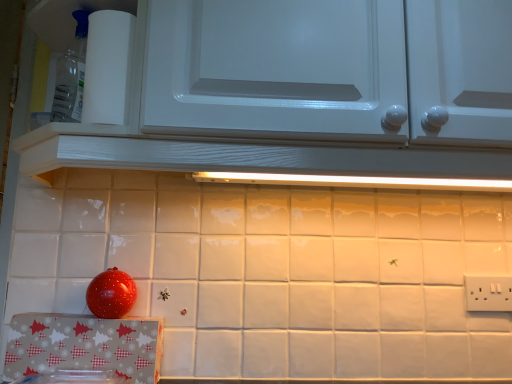
Question: Does white paper towel at upper left come behind white glossy cabinet at upper center?

Choices:
 (A) yes
 (B) no

Answer: (A)

Question: From a real-world perspective, is white paper towel at upper left physically below white glossy cabinet at upper center?

Choices:
 (A) no
 (B) yes

Answer: (B)

Question: Can we say white paper towel at upper left lies outside white glossy cabinet at upper center?

Choices:
 (A) no
 (B) yes

Answer: (A)

Question: Can you confirm if white paper towel at upper left is shorter than white glossy cabinet at upper center?

Choices:
 (A) no
 (B) yes

Answer: (B)

Question: From a real-world perspective, is white paper towel at upper left physically above white glossy cabinet at upper center?

Choices:
 (A) no
 (B) yes

Answer: (A)

Question: From the image's perspective, is white paper towel at upper left above white glossy cabinet at upper center?

Choices:
 (A) yes
 (B) no

Answer: (B)

Question: Is white plastic electric outlet at lower right not inside white glossy cabinet at upper center?

Choices:
 (A) no
 (B) yes

Answer: (B)

Question: Would you say white plastic electric outlet at lower right is a long distance from white glossy cabinet at upper center?

Choices:
 (A) yes
 (B) no

Answer: (B)

Question: Is the depth of white plastic electric outlet at lower right less than that of white glossy cabinet at upper center?

Choices:
 (A) yes
 (B) no

Answer: (B)

Question: Does white plastic electric outlet at lower right have a smaller size compared to white glossy cabinet at upper center?

Choices:
 (A) no
 (B) yes

Answer: (B)

Question: Considering the relative positions of white plastic electric outlet at lower right and white glossy cabinet at upper center in the image provided, is white plastic electric outlet at lower right to the right of white glossy cabinet at upper center from the viewer's perspective?

Choices:
 (A) yes
 (B) no

Answer: (A)

Question: Is white plastic electric outlet at lower right turned away from white glossy cabinet at upper center?

Choices:
 (A) no
 (B) yes

Answer: (A)

Question: Does white plastic electric outlet at lower right lie in front of white paper towel at upper left?

Choices:
 (A) no
 (B) yes

Answer: (A)